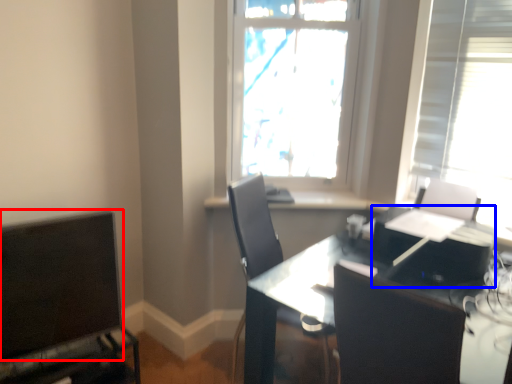
Question: Among these objects, which one is farthest to the camera, computer monitor (highlighted by a red box) or computer (highlighted by a blue box)?

Choices:
 (A) computer monitor
 (B) computer

Answer: (A)